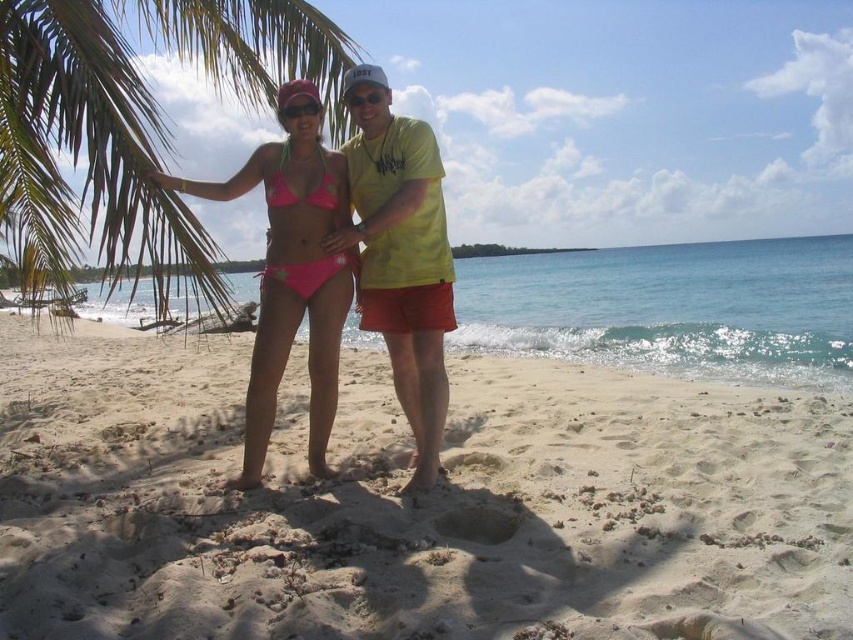
Question: Based on their relative distances, which object is farther from the yellow matte shirt at center?

Choices:
 (A) green leafy palm tree at upper left
 (B) white sandy beach at center

Answer: (A)

Question: Which of the following is the closest to the observer?

Choices:
 (A) green leafy palm tree at upper left
 (B) white sandy beach at center
 (C) yellow matte shirt at center

Answer: (B)

Question: Can you confirm if white sandy beach at center is positioned to the right of green leafy palm tree at upper left?

Choices:
 (A) no
 (B) yes

Answer: (B)

Question: Can you confirm if green leafy palm tree at upper left is smaller than pink fabric bikini at center?

Choices:
 (A) no
 (B) yes

Answer: (A)

Question: Estimate the real-world distances between objects in this image. Which object is farther from the pink fabric bikini at center?

Choices:
 (A) white sandy beach at center
 (B) yellow matte shirt at center
 (C) green leafy palm tree at upper left

Answer: (C)

Question: Is white sandy beach at center to the right of yellow matte shirt at center from the viewer's perspective?

Choices:
 (A) no
 (B) yes

Answer: (A)